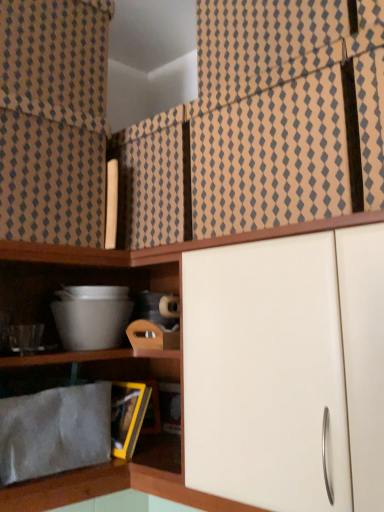
Question: Should I look upward or downward to see beige textured curtain at upper left, arranged as the 2th curtain when viewed from the right?

Choices:
 (A) down
 (B) up

Answer: (B)

Question: Can you confirm if brown textured fabric at upper center, the second curtain in the left-to-right sequence, is taller than gray fabric at lower left?

Choices:
 (A) no
 (B) yes

Answer: (B)

Question: From the image's perspective, does brown textured fabric at upper center, the second curtain in the left-to-right sequence, appear lower than gray fabric at lower left?

Choices:
 (A) no
 (B) yes

Answer: (A)

Question: Is brown textured fabric at upper center, which ranks as the 1th curtain in right-to-left order, at the right side of gray fabric at lower left?

Choices:
 (A) no
 (B) yes

Answer: (B)

Question: Can you confirm if brown textured fabric at upper center, which ranks as the 1th curtain in right-to-left order, is shorter than gray fabric at lower left?

Choices:
 (A) no
 (B) yes

Answer: (A)

Question: Is brown textured fabric at upper center, which ranks as the 1th curtain in right-to-left order, smaller than gray fabric at lower left?

Choices:
 (A) yes
 (B) no

Answer: (B)

Question: Is brown textured fabric at upper center, which ranks as the 1th curtain in right-to-left order, positioned behind gray fabric at lower left?

Choices:
 (A) no
 (B) yes

Answer: (A)

Question: From the image's perspective, is gray fabric at lower left located beneath beige textured curtain at upper left, arranged as the 2th curtain when viewed from the right?

Choices:
 (A) yes
 (B) no

Answer: (A)

Question: Would you say beige textured curtain at upper left, which ranks as the first curtain in left-to-right order, is part of gray fabric at lower left's contents?

Choices:
 (A) no
 (B) yes

Answer: (A)

Question: Is beige textured curtain at upper left, arranged as the 2th curtain when viewed from the right, at the back of gray fabric at lower left?

Choices:
 (A) yes
 (B) no

Answer: (B)

Question: Is gray fabric at lower left positioned behind beige textured curtain at upper left, which ranks as the first curtain in left-to-right order?

Choices:
 (A) no
 (B) yes

Answer: (A)

Question: Is gray fabric at lower left to the left of beige textured curtain at upper left, arranged as the 2th curtain when viewed from the right, from the viewer's perspective?

Choices:
 (A) no
 (B) yes

Answer: (A)

Question: Is gray fabric at lower left closer to the viewer compared to beige textured curtain at upper left, arranged as the 2th curtain when viewed from the right?

Choices:
 (A) yes
 (B) no

Answer: (A)

Question: Is brown textured fabric at upper center, which ranks as the 1th curtain in right-to-left order, facing away from beige textured curtain at upper left, which ranks as the first curtain in left-to-right order?

Choices:
 (A) no
 (B) yes

Answer: (A)